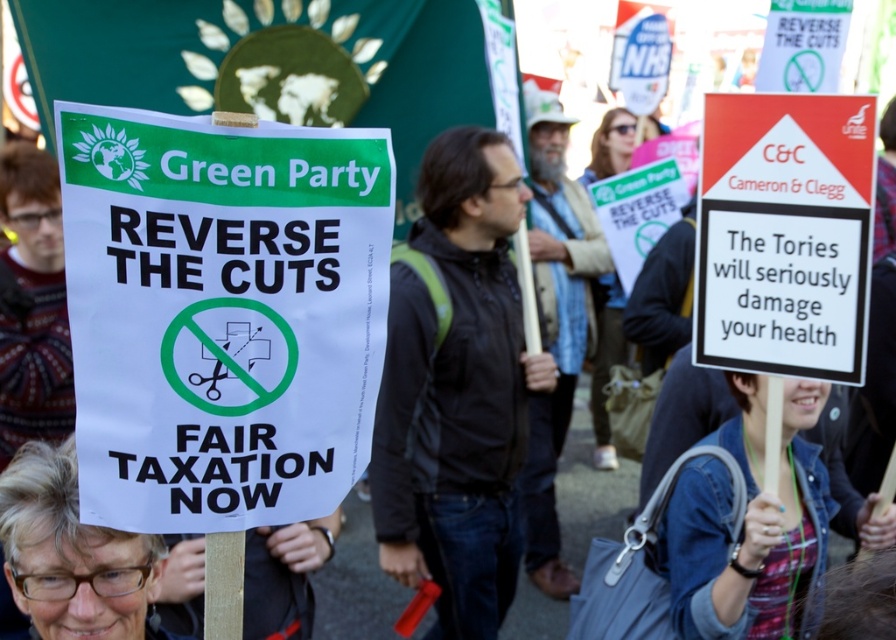
Question: Which object is farther from the camera taking this photo?

Choices:
 (A) black jacket at center
 (B) white paper sign at center

Answer: (A)

Question: Which point is farther from the camera taking this photo?

Choices:
 (A) (272, 161)
 (B) (455, 564)

Answer: (B)

Question: Is white paper sign at center smaller than black jacket at center?

Choices:
 (A) yes
 (B) no

Answer: (A)

Question: Does white paper sign at center appear on the right side of black jacket at center?

Choices:
 (A) yes
 (B) no

Answer: (B)

Question: Can you confirm if white paper sign at center is positioned above black jacket at center?

Choices:
 (A) no
 (B) yes

Answer: (B)

Question: Among these objects, which one is farthest from the camera?

Choices:
 (A) black jacket at center
 (B) white paper sign at center

Answer: (A)